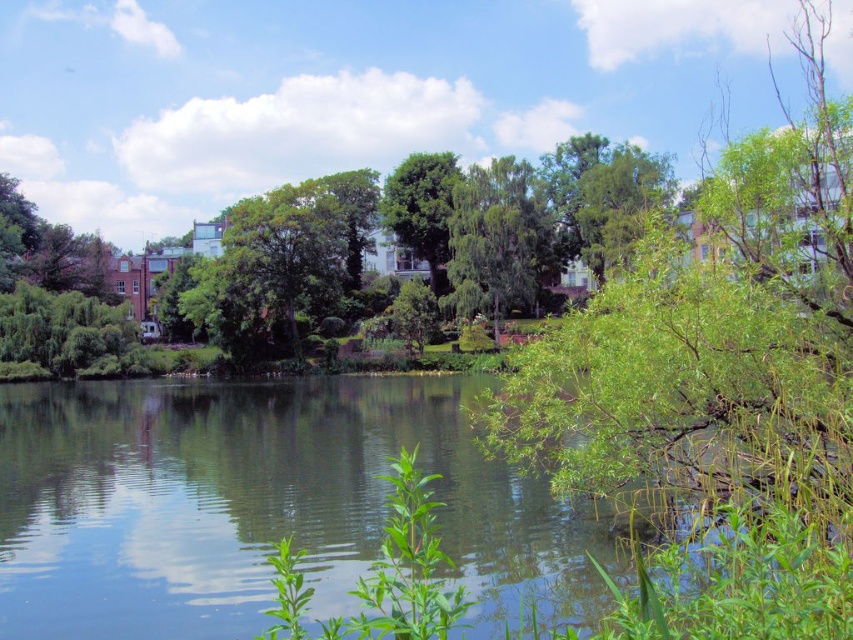
You are a bird flying over the lakeside scene. You see the green leafy water at center and the green leafy tree at center. Which one is directly above the other?

The green leafy tree at center is directly above the green leafy water at center because the water is positioned under the tree.

You are standing at the lakeside and see the green leafy water at center and the green leafy tree at center. Which one is taller?

The green leafy water at center is not as tall as green leafy tree at center, so the green leafy tree at center is taller.